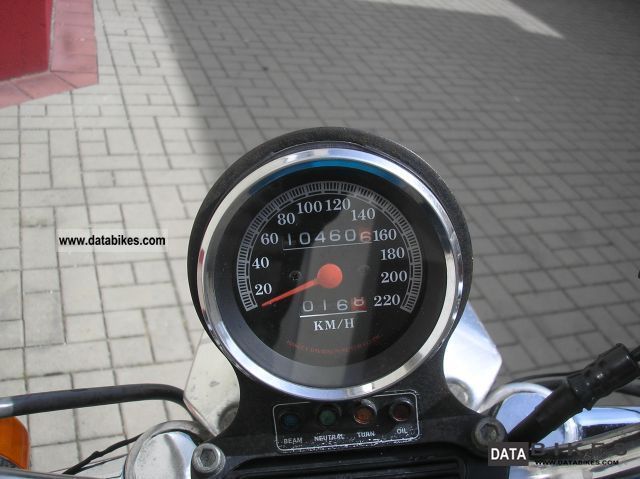
Image resolution: width=640 pixels, height=479 pixels. Identify the location of lights. (411, 411), (360, 419), (324, 416).